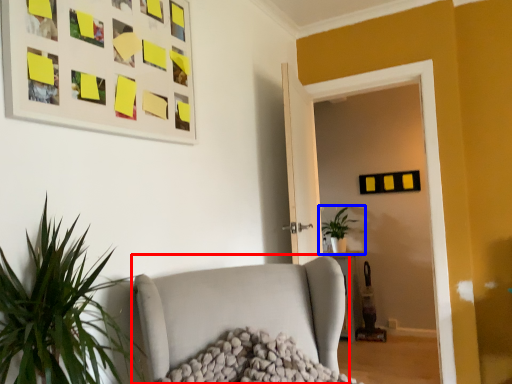
Question: Which object appears farthest to the camera in this image, studio couch (highlighted by a red box) or houseplant (highlighted by a blue box)?

Choices:
 (A) studio couch
 (B) houseplant

Answer: (B)